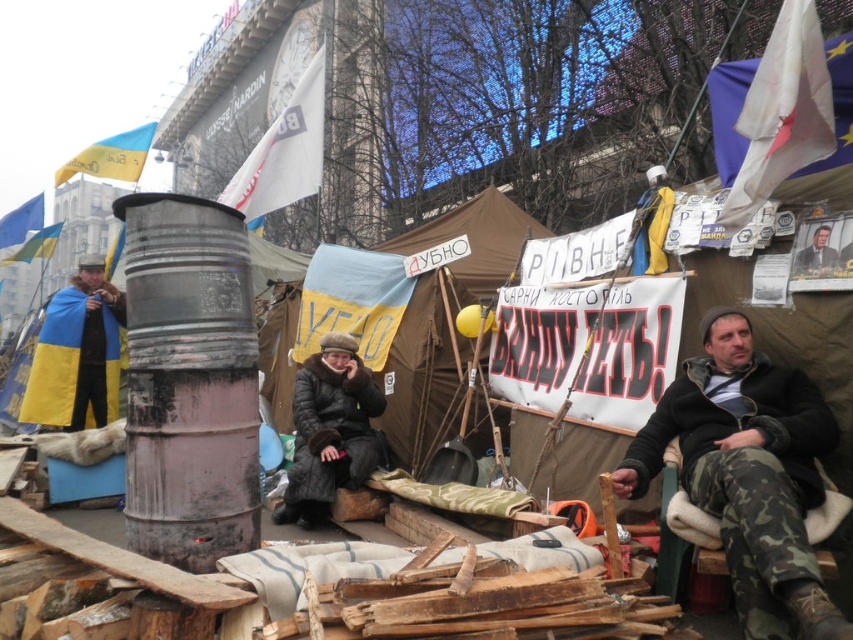
Question: Can you confirm if blue fabric tent at center is smaller than yellow-blue fabric draped at left?

Choices:
 (A) no
 (B) yes

Answer: (B)

Question: Which point is farther to the camera?

Choices:
 (A) yellow-blue fabric draped at left
 (B) smooth gray suit at upper right
 (C) camouflage pants at lower right
 (D) dark brown fur coat at center

Answer: (A)

Question: Is yellow-blue fabric draped at left bigger than smooth gray suit at upper right?

Choices:
 (A) no
 (B) yes

Answer: (B)

Question: Which point is farther to the camera?

Choices:
 (A) dark brown fur coat at center
 (B) smooth gray suit at upper right
 (C) blue fabric tent at center

Answer: (C)

Question: Which point appears farthest from the camera in this image?

Choices:
 (A) click(78, 381)
 (B) click(820, 275)
 (C) click(828, 452)

Answer: (A)

Question: Can you confirm if camouflage pants at lower right is bigger than blue fabric tent at center?

Choices:
 (A) no
 (B) yes

Answer: (A)